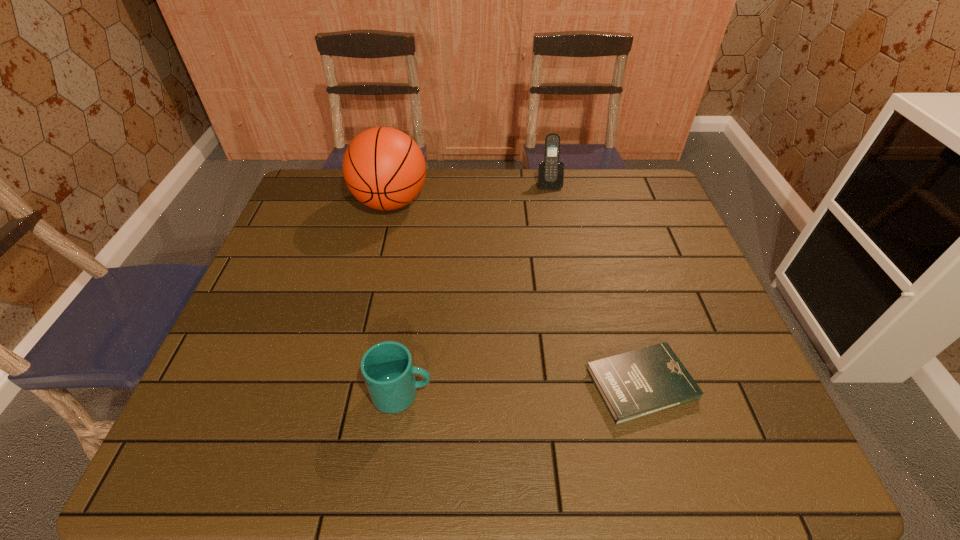
Locate an element on the screen. basketball is located at coordinates (384, 168).

In order to click on the third shortest object in this screenshot , I will do `click(550, 172)`.

Locate an element on the screen. The image size is (960, 540). cup is located at coordinates (387, 368).

At what (x,y) coordinates should I click in order to perform the action: click on the shortest object. Please return your answer as a coordinate pair (x, y). The width and height of the screenshot is (960, 540). Looking at the image, I should click on (645, 381).

The height and width of the screenshot is (540, 960). In order to click on free region located on the right of the basketball in this screenshot , I will do `click(469, 202)`.

This screenshot has height=540, width=960. What are the coordinates of `free location located 0.170m on the front-facing side of the third shortest object` in the screenshot? It's located at (557, 223).

Identify the location of free region located 0.160m on the handle side of the third tallest object. The image size is (960, 540). (508, 394).

This screenshot has width=960, height=540. What are the coordinates of `free spot located on the front of the book` in the screenshot? It's located at 660,449.

The width and height of the screenshot is (960, 540). In order to click on basketball that is at the far edge in this screenshot , I will do `click(384, 168)`.

What are the coordinates of `cellular telephone situated at the far edge` in the screenshot? It's located at (550, 172).